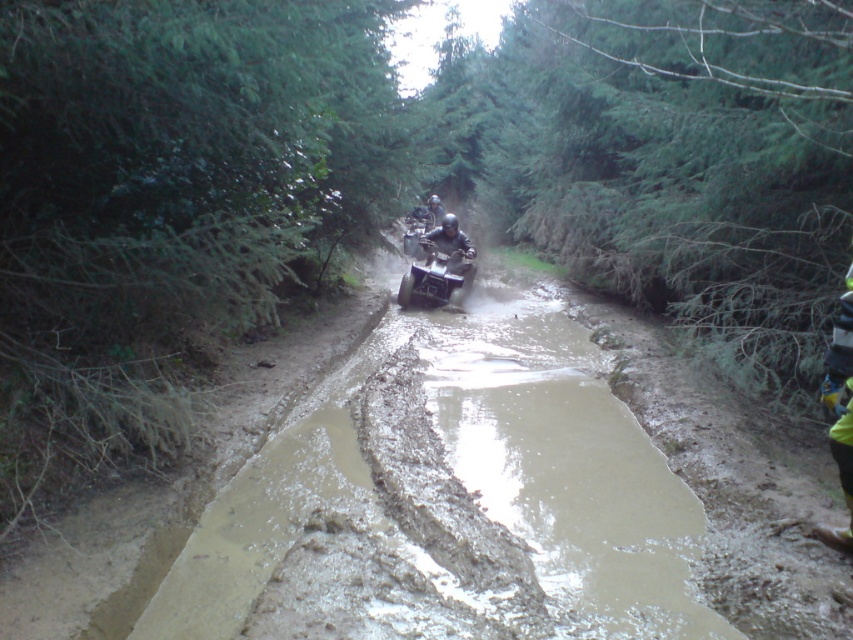
You are a photographer planning to capture both the metallic silver quad bike at center and the matte black quad bike at center in a single frame. Considering their sizes, which quad bike would appear larger in your photo?

The metallic silver quad bike at center would appear larger in the photo because it is bigger than the matte black quad bike at center.

You are a forest ranger planning to drive both the metallic silver quad bike at center and the matte black quad bike at center through this narrow muddy path. Considering the path width and the ATVs dimensions, which ATV do you think might have difficulty passing through the path?

The metallic silver quad bike at center might have difficulty passing through the path since it is wider than the matte black quad bike at center.

You are standing at the point with coordinates point (439, 269). Looking around, what vehicle are you directly at?

The point (439, 269) corresponds to the metallic silver quad bike at center.